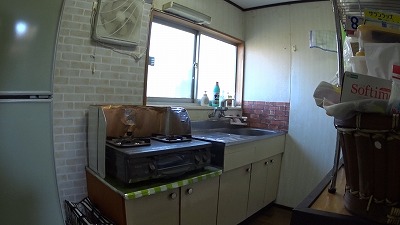
I want to click on green refrigerator, so click(20, 135).